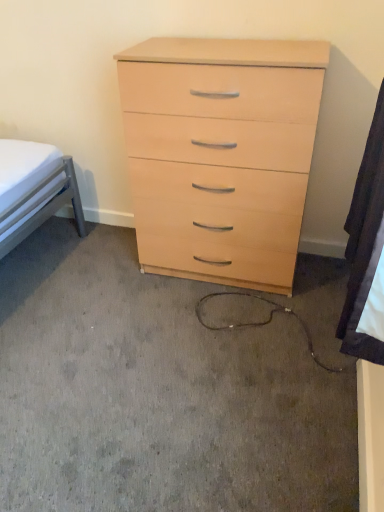
Locate an element on the screen. vacant space underneath white fabric at lower right (from a real-world perspective) is located at coordinates (323, 401).